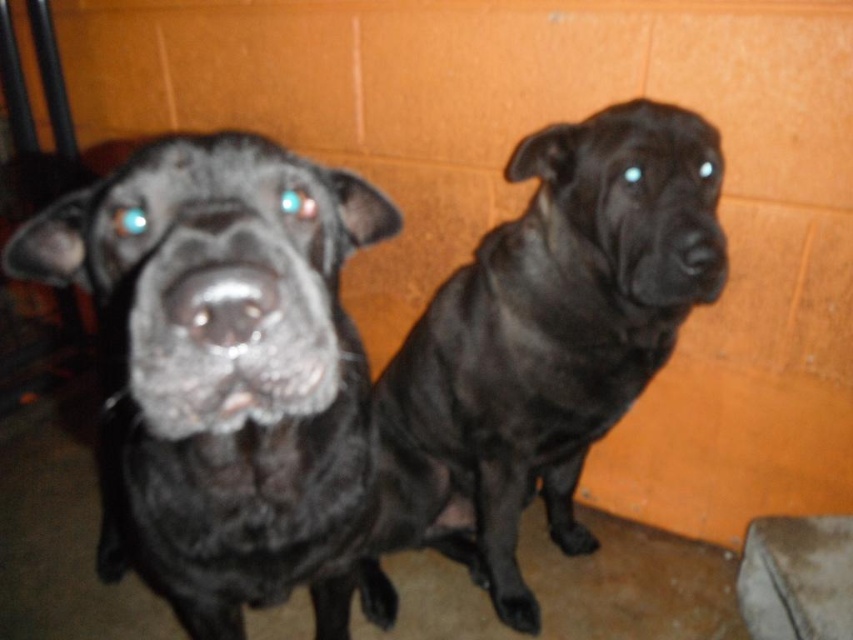
Question: Which point is closer to the camera?

Choices:
 (A) shiny black dog at left
 (B) shiny black dog at center

Answer: (A)

Question: Which point is farther from the camera taking this photo?

Choices:
 (A) (264, 518)
 (B) (416, 348)

Answer: (B)

Question: Can you confirm if shiny black dog at left is smaller than shiny black dog at center?

Choices:
 (A) no
 (B) yes

Answer: (A)

Question: Considering the relative positions of shiny black dog at left and shiny black dog at center in the image provided, where is shiny black dog at left located with respect to shiny black dog at center?

Choices:
 (A) below
 (B) above

Answer: (A)

Question: Is shiny black dog at left thinner than shiny black dog at center?

Choices:
 (A) yes
 (B) no

Answer: (B)